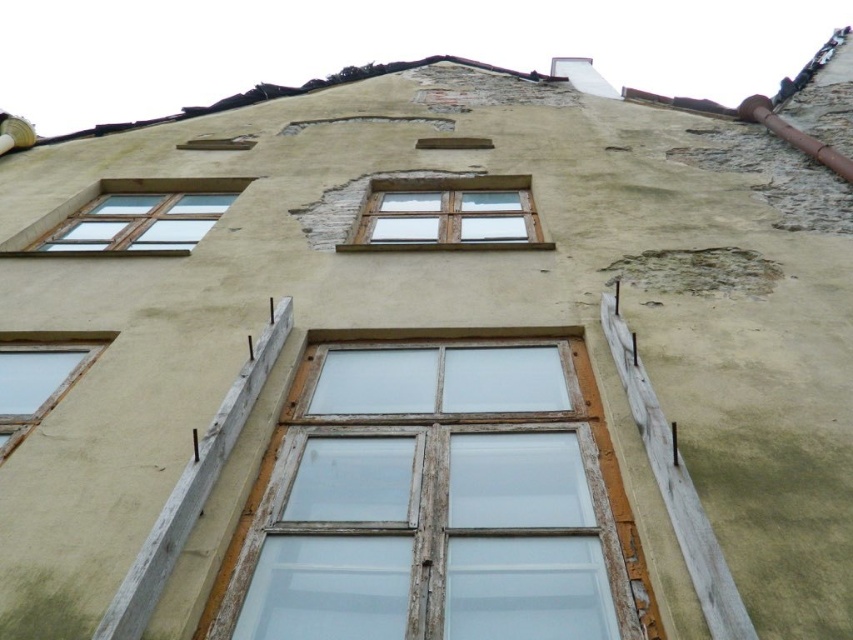
You are standing in front of the building and want to know which window is higher up. Can you tell me which one is located higher between the clear glass window at upper left and the transparent glass window at lower left?

The clear glass window at upper left is positioned over the transparent glass window at lower left, so it is higher up.

You are an architect evaluating the building facade. You see the weathered wood window at center and the transparent glass window at lower left. Which window has a larger size?

The weathered wood window at center is bigger than the transparent glass window at lower left, so the weathered wood window at center has a larger size.

You are standing in front of the building and want to locate the clear glass window at upper left. What are the coordinates of its position?

The clear glass window at upper left is located at coordinates point (x=129, y=218).